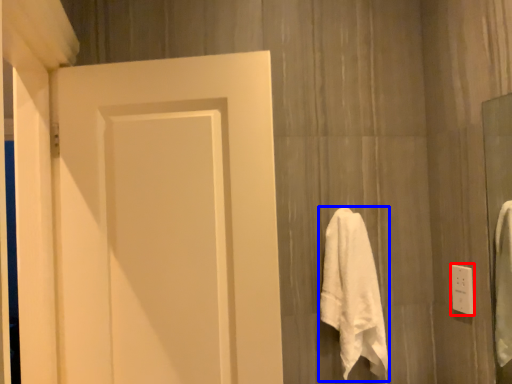
Question: Which point is closer to the camera, electric outlet (highlighted by a red box) or towel (highlighted by a blue box)?

Choices:
 (A) electric outlet
 (B) towel

Answer: (B)